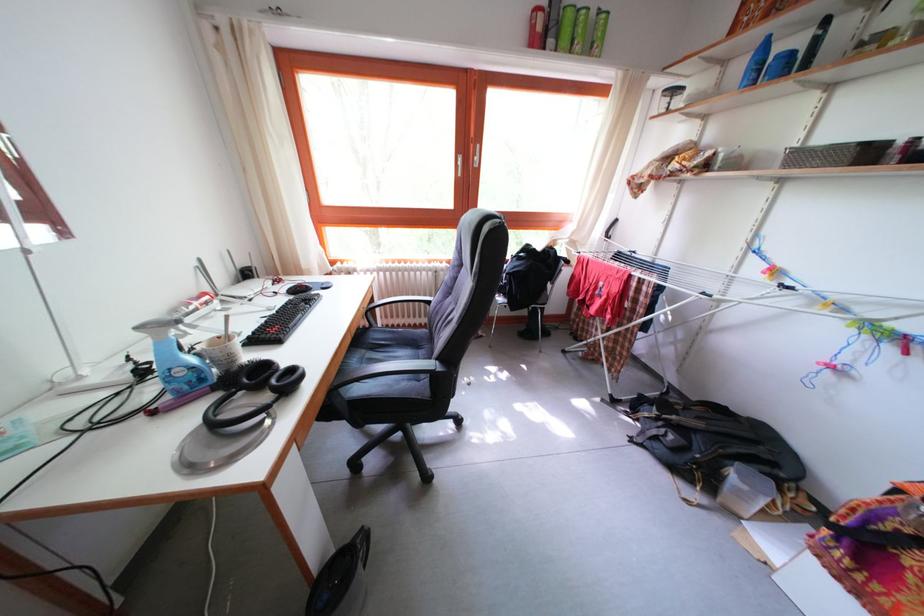
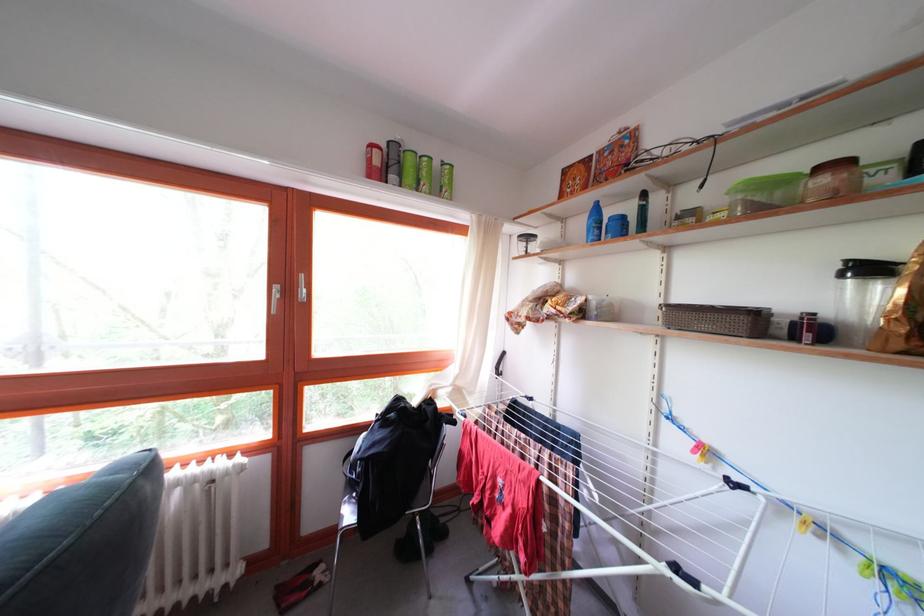
Find the pixel in the second image that matches the point at 565,46 in the first image.

(409, 180)